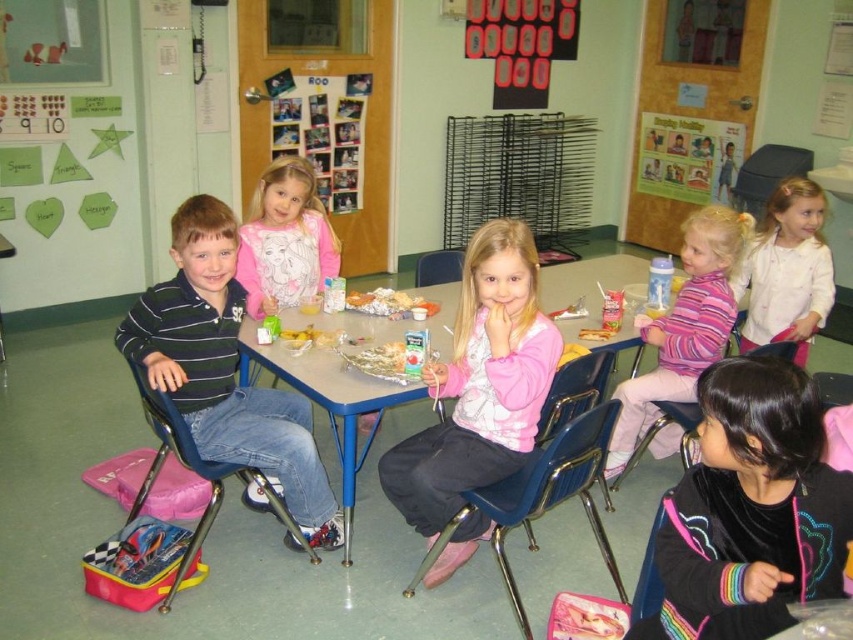
Who is more distant from viewer, (315, 480) or (653, 529)?

Point (315, 480)

The image size is (853, 640). What do you see at coordinates (225, 369) in the screenshot? I see `striped cotton shirt at center` at bounding box center [225, 369].

The image size is (853, 640). In order to click on striped cotton shirt at center in this screenshot , I will do `click(225, 369)`.

In the scene shown: Who is taller, smooth plastic table at center or crumbly golden cookies at center?

smooth plastic table at center

Can you confirm if smooth plastic table at center is positioned above crumbly golden cookies at center?

Incorrect, smooth plastic table at center is not positioned above crumbly golden cookies at center.

Which is behind, point (577, 264) or point (367, 310)?

Point (577, 264)

Where is `smooth plastic table at center`? smooth plastic table at center is located at coordinates (328, 400).

Is pink fleece jacket at center to the left of striped cotton shirt at center from the viewer's perspective?

In fact, pink fleece jacket at center is to the right of striped cotton shirt at center.

Can you confirm if pink fleece jacket at center is bigger than striped cotton shirt at center?

No, pink fleece jacket at center is not bigger than striped cotton shirt at center.

Is point (485, 241) in front of point (312, 481)?

Yes, point (485, 241) is closer to viewer.

The width and height of the screenshot is (853, 640). I want to click on pink fleece jacket at center, so click(479, 384).